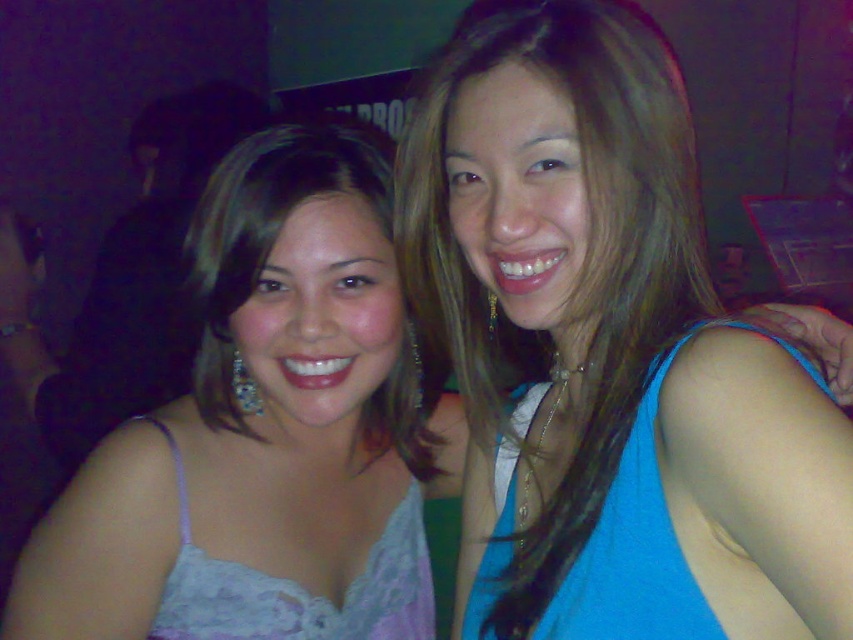
You are a photographer trying to capture a clear shot of the lace fabric dress at center and the lace fabric dress at lower left. Since the background is busy, you want to ensure both dresses are in focus. Which dress should you focus on first to maximize sharpness, considering their sizes?

The lace fabric dress at center is larger in size than the lace fabric dress at lower left, so focusing on the lace fabric dress at center first would help ensure both dresses remain in focus as it occupies more of the frame.

You are a photographer trying to adjust the lighting for a photo. You notice a point at coordinates (610, 353) in the image. According to the scene description, what object is located at this point?

The point at coordinates (610, 353) corresponds to the blue fabric top at upper right.

You are a photographer trying to focus on the lace fabric dress at center and the lace fabric dress at lower left. Which dress should you adjust your camera focus to first if you want to capture both clearly?

The lace fabric dress at center is closer to the viewer than the lace fabric dress at lower left. To capture both clearly, adjust focus starting with the lace fabric dress at center first, then recompose for the lace fabric dress at lower left.